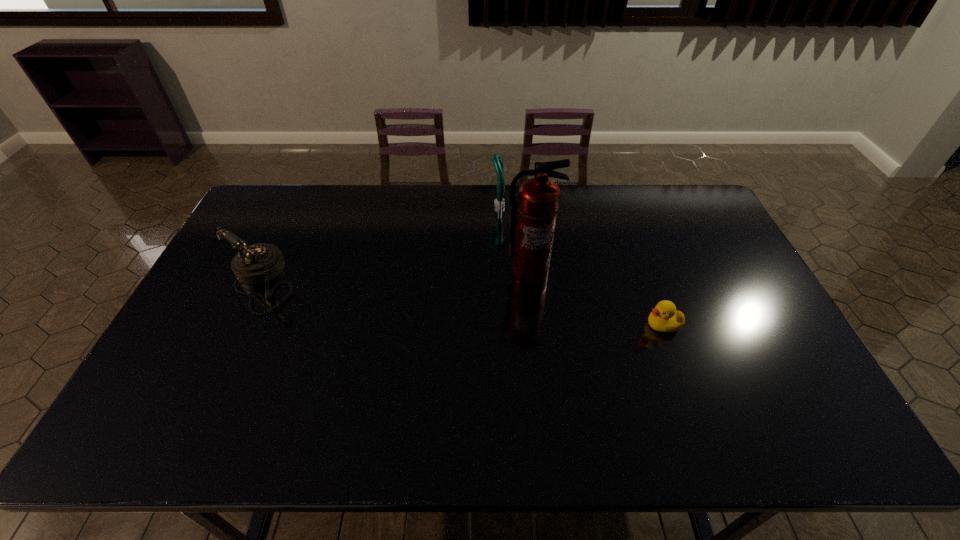
You are a GUI agent. You are given a task and a screenshot of the screen. Output one action in this format:
    pyautogui.click(x=<x>, y=<y>)
    Task: Click on the tallest object
    The image size is (960, 540).
    Given the screenshot: What is the action you would take?
    pyautogui.click(x=537, y=207)

Locate an element on the screen. Image resolution: width=960 pixels, height=540 pixels. bottle opener is located at coordinates (497, 160).

Where is `the second tallest object`? The width and height of the screenshot is (960, 540). the second tallest object is located at coordinates (497, 160).

Find the location of a particular element. Image resolution: width=960 pixels, height=540 pixels. the leftmost object is located at coordinates (258, 263).

I want to click on telephone, so click(258, 263).

In order to click on the rightmost object in this screenshot , I will do `click(664, 318)`.

Locate an element on the screen. This screenshot has height=540, width=960. the shortest object is located at coordinates (664, 318).

Where is `vacant space located 0.130m on the nozzle side of the fire extinguisher`? The width and height of the screenshot is (960, 540). vacant space located 0.130m on the nozzle side of the fire extinguisher is located at coordinates (535, 320).

Locate an element on the screen. Image resolution: width=960 pixels, height=540 pixels. vacant area situated at the jaws of the farthest object is located at coordinates (463, 205).

This screenshot has height=540, width=960. Identify the location of free space located 0.300m at the jaws of the farthest object. (408, 205).